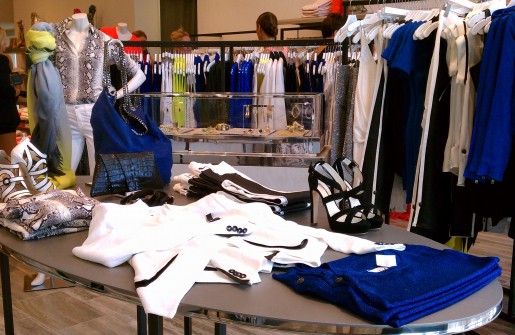
The image size is (515, 335). What are the coordinates of `wood floor` in the screenshot? It's located at (84, 315).